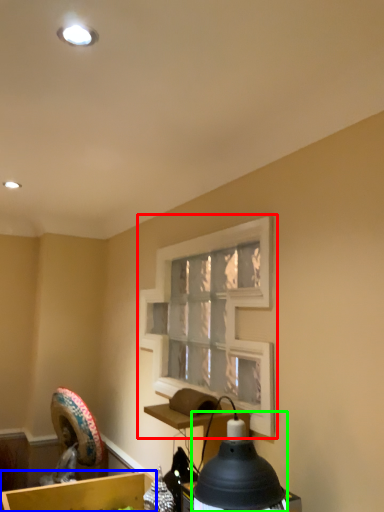
Question: Which object is the closest to the window frame (highlighted by a red box)? Choose among these: cardboard box (highlighted by a blue box) or lamp (highlighted by a green box).

Choices:
 (A) cardboard box
 (B) lamp

Answer: (B)